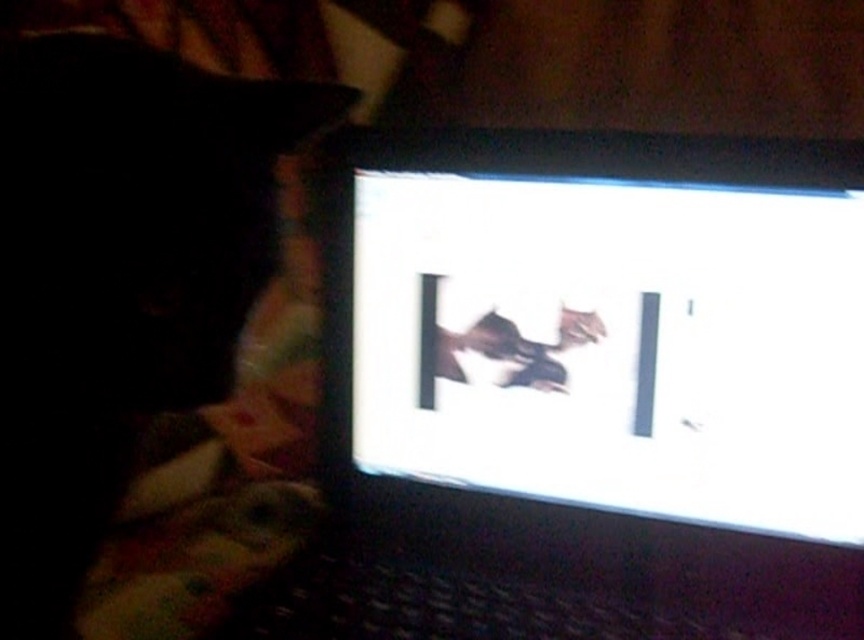
Which is behind, point (363, 480) or point (160, 272)?

Positioned behind is point (363, 480).

Which of these two, matte black laptop at center or matte black laptop at upper right, stands shorter?

A: Standing shorter between the two is matte black laptop at upper right.

Is point (716, 333) closer to viewer compared to point (113, 301)?

No, it is behind (113, 301).

At what (x,y) coordinates should I click in order to perform the action: click on matte black laptop at center. Please return your answer as a coordinate pair (x, y). This screenshot has height=640, width=864. Looking at the image, I should click on (589, 388).